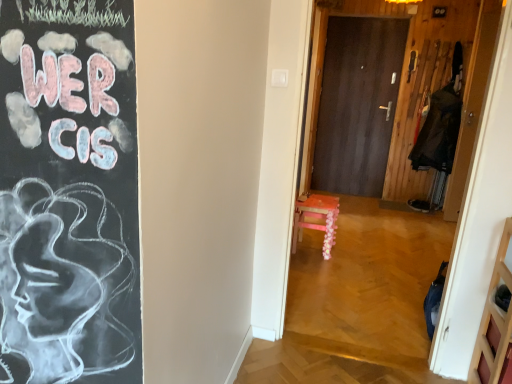
Locate an element on the screen. This screenshot has width=512, height=384. free point above dark wood door at center, positioned as the 1th door in back-to-front order (from a real-world perspective) is located at coordinates (368, 19).